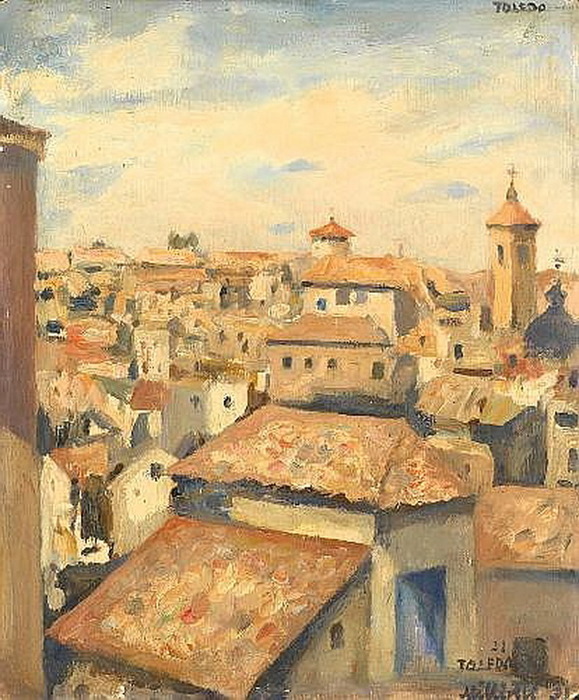
The width and height of the screenshot is (579, 700). I want to click on door opening, bblue, so (x=428, y=619).